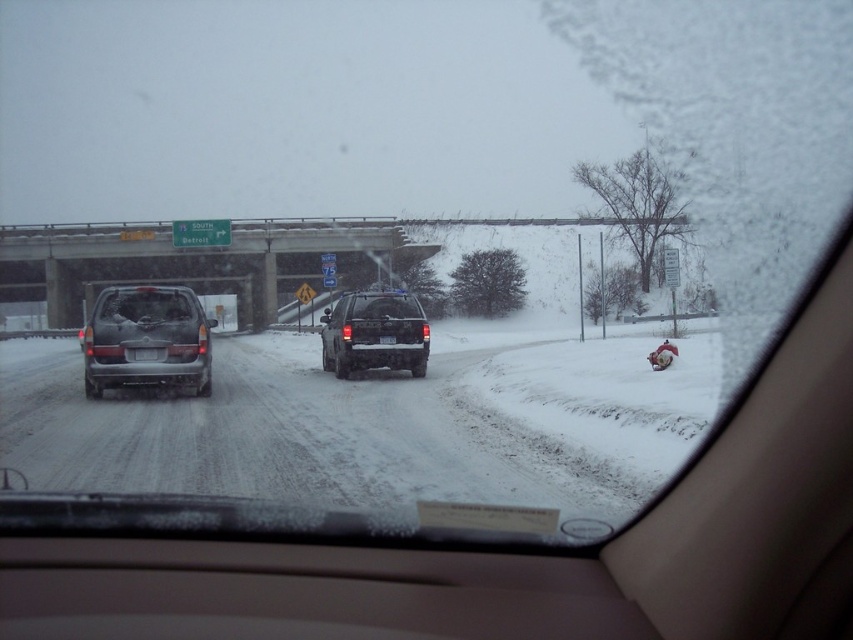
You are a driver trying to navigate a snowy road. You see a concrete bridge at center and a black plastic license plate at rear. Which object is larger in the image?

The concrete bridge at center is bigger than the black plastic license plate at rear, so the concrete bridge at center is larger in the image.

Looking at this image, you are a passenger in the car and notice a point on the windshield at coordinates (256, 259). What object is located at that point in the scene?

The concrete bridge at center is located at point (256, 259).

You are a passenger in the car and notice the concrete bridge at center. Based on its position, can you estimate whether it is closer to the front or the back of the car?

The concrete bridge at center is located at point coordinates that are closer to the front of the car, so it is positioned closer to the front.